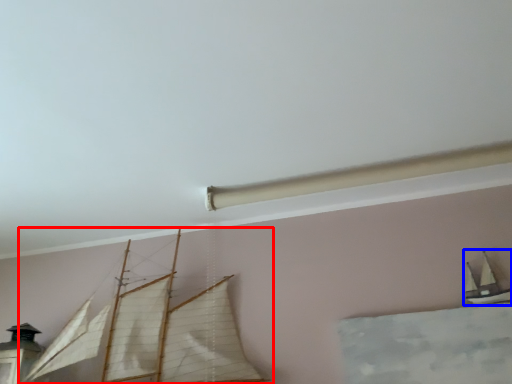
Question: Which object is closer to the camera taking this photo, boat (highlighted by a red box) or boat (highlighted by a blue box)?

Choices:
 (A) boat
 (B) boat

Answer: (A)